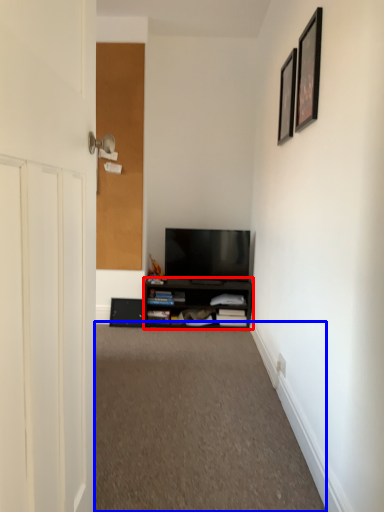
Question: Which of the following is the farthest to the observer, cabinetry (highlighted by a red box) or plain (highlighted by a blue box)?

Choices:
 (A) cabinetry
 (B) plain

Answer: (A)